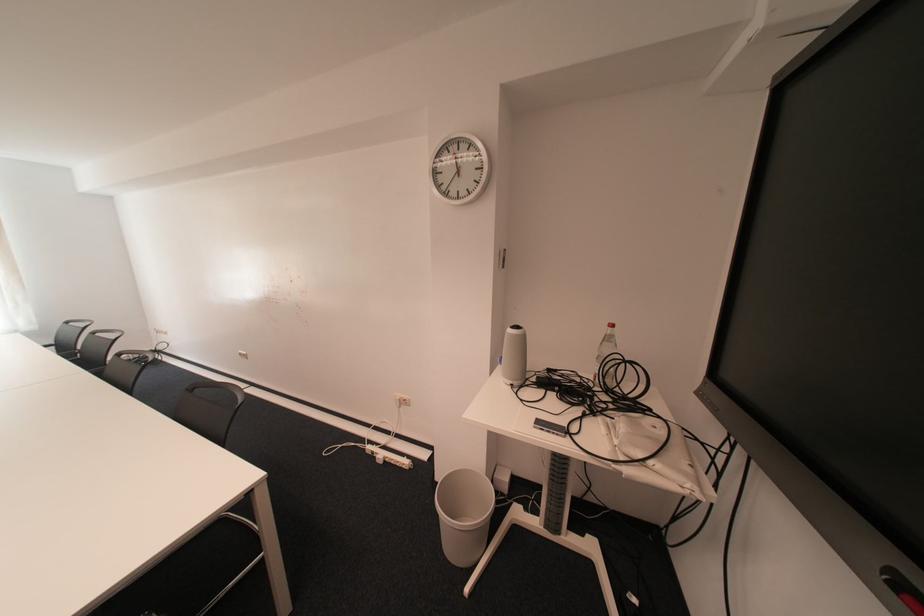
Find where to lift the plastic water bottle. Please return your answer as a coordinate pair (x, y).

(606, 357)